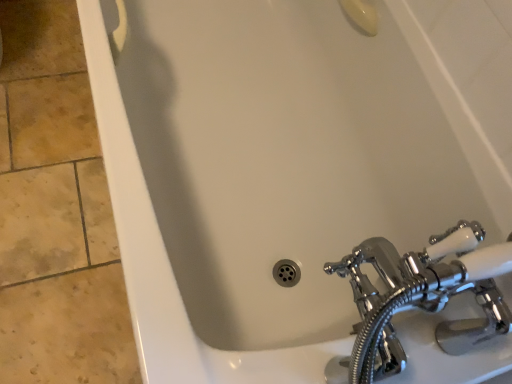
Describe the element at coordinates (421, 298) in the screenshot. The height and width of the screenshot is (384, 512). I see `chrome/metallic faucet at lower right` at that location.

What are the coordinates of `chrome/metallic faucet at lower right` in the screenshot? It's located at (421, 298).

What is the approximate width of chrome/metallic faucet at lower right?

It is 9.12 inches.

I want to click on chrome/metallic faucet at lower right, so click(x=421, y=298).